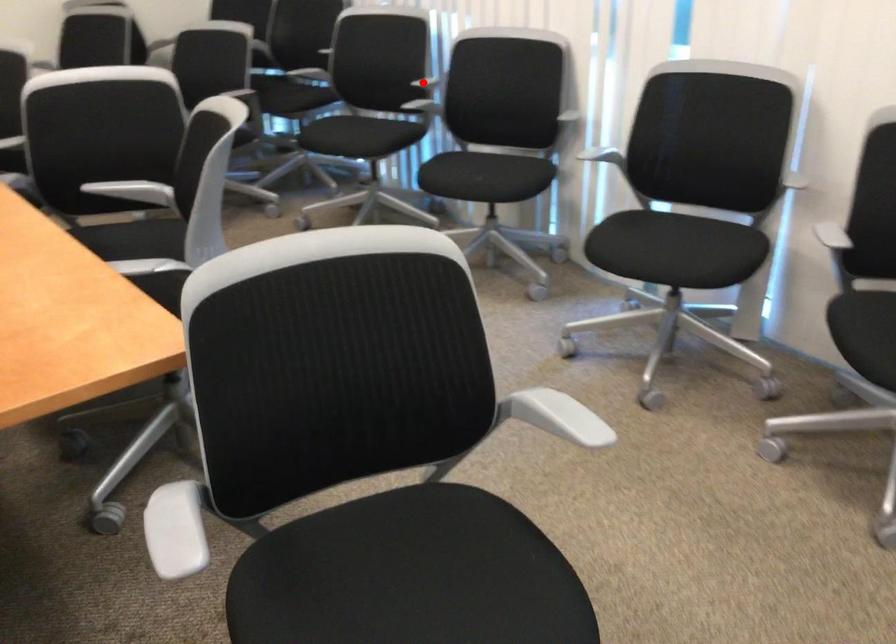
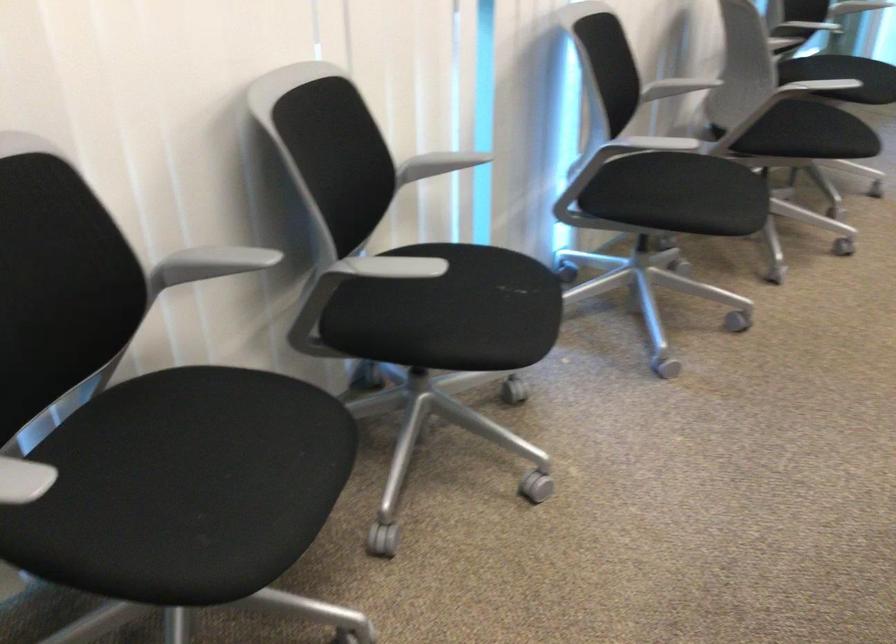
Question: I am providing you with two images of the same scene from different viewpoints. A red point is marked on the first image. Can you still see the location of the red point in image 2?

Choices:
 (A) Yes
 (B) No

Answer: (A)